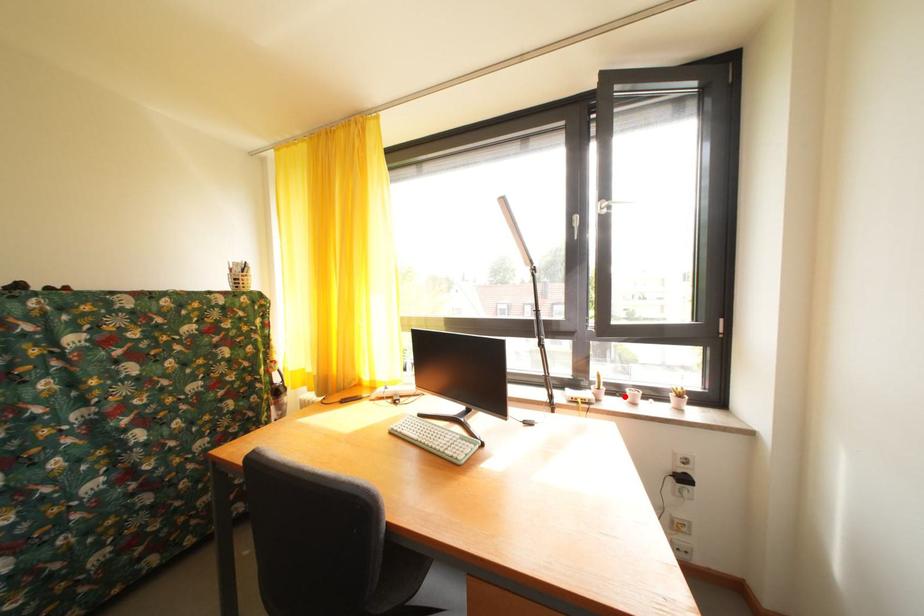
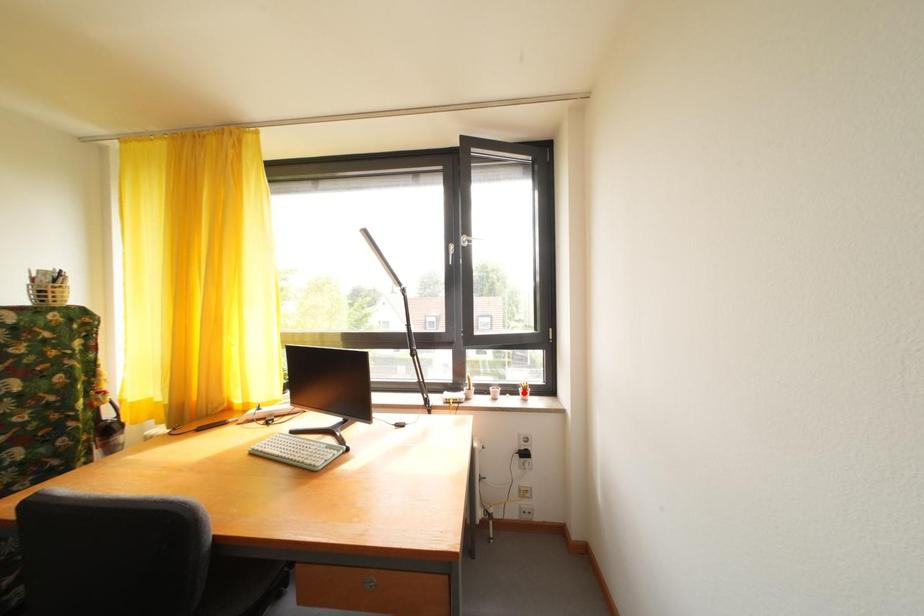
I am providing you with two images of the same scene from different viewpoints. A red point is marked on the first image and another point is marked on the second image. Do the highlighted points in image1 and image2 indicate the same real-world spot?

No